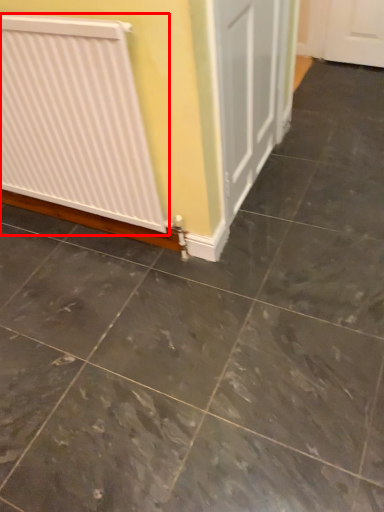
Question: From the image, what is the correct spatial relationship of radiator (annotated by the red box) in relation to concrete?

Choices:
 (A) left
 (B) right

Answer: (A)